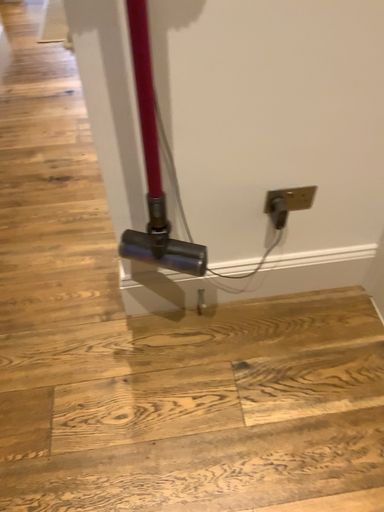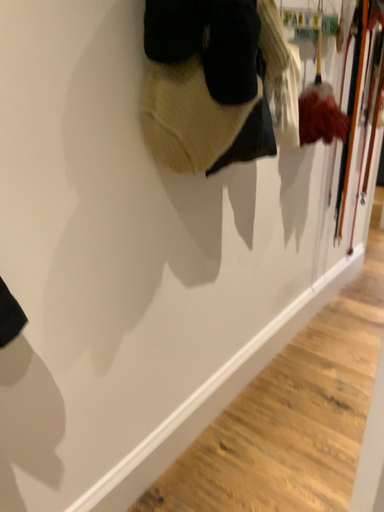
Question: How did the camera likely rotate when shooting the video?

Choices:
 (A) rotated left
 (B) rotated right

Answer: (A)